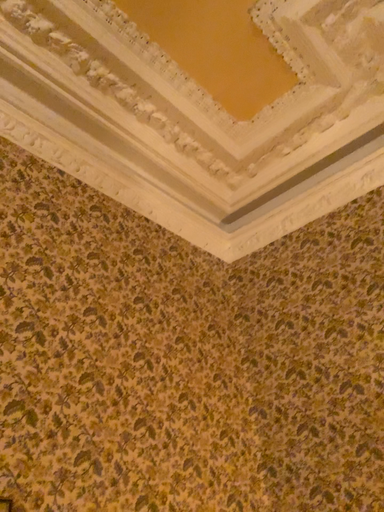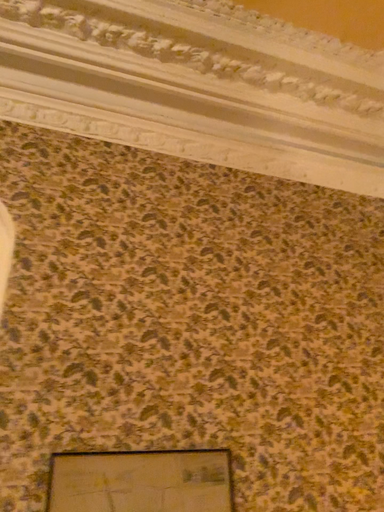
Question: Which way did the camera rotate in the video?

Choices:
 (A) rotated upward
 (B) rotated downward

Answer: (B)